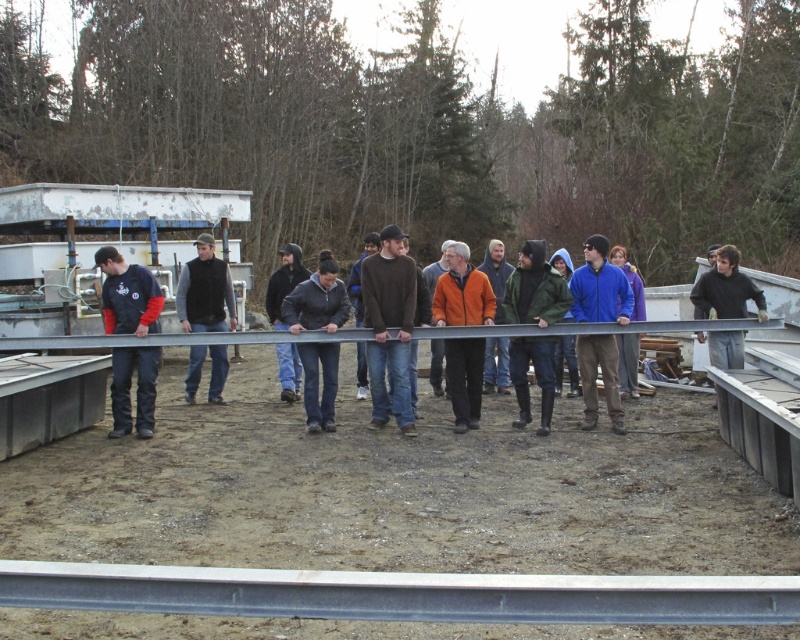
Question: Can you confirm if gray metallic rail at center is positioned to the left of brown sweater at center?

Choices:
 (A) no
 (B) yes

Answer: (A)

Question: Does brown sweater at center have a greater width compared to dark green woolen jacket at center?

Choices:
 (A) yes
 (B) no

Answer: (B)

Question: Is gray metallic rail at center positioned at the back of blue fleece jacket at center?

Choices:
 (A) yes
 (B) no

Answer: (B)

Question: Which point is closer to the camera?

Choices:
 (A) (141, 403)
 (B) (388, 276)

Answer: (B)

Question: Which point is farther to the camera?

Choices:
 (A) brown sweater at center
 (B) dark gray fleece jacket at center
 (C) orange fleece jacket at center

Answer: (C)

Question: Which point is closer to the camera taking this photo?

Choices:
 (A) (324, 392)
 (B) (496, 252)
 (C) (612, 305)

Answer: (C)